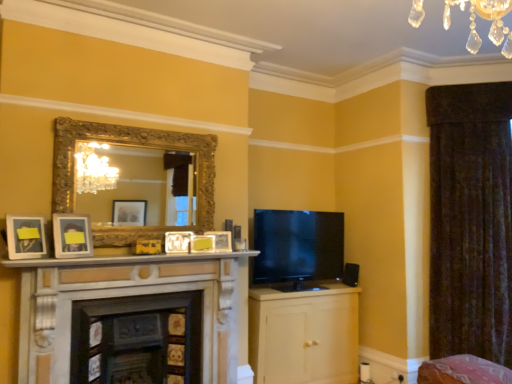
You are a GUI agent. You are given a task and a screenshot of the screen. Output one action in this format:
    pyautogui.click(x=<x>, y=<y>)
    Task: Click on the free point below matte silver picture frame at center, the fourth picture frame in the right-to-left sequence (from a real-world perspective)
    The image size is (512, 384).
    Given the screenshot: What is the action you would take?
    pyautogui.click(x=145, y=249)